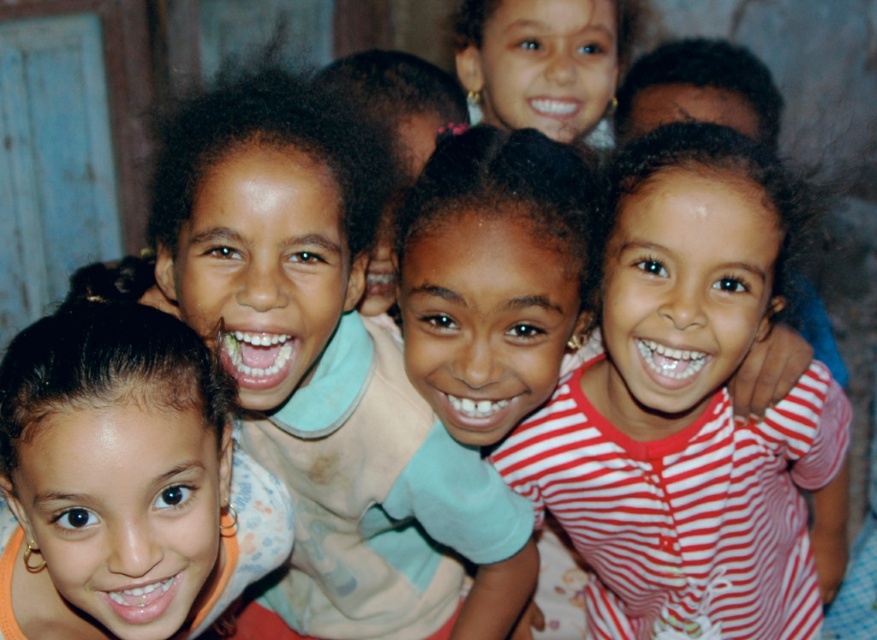
You are a photographer trying to capture a group shot of the children. You notice the matte orange shirt at lower left and the matte black hair at upper center. Which child should you adjust to the right to ensure both are centered in the frame?

You should move the matte orange shirt at lower left to the right since it is currently on the left side of the matte black hair at upper center, which would help center both in the frame.

You are a photographer trying to capture a closeup of the red striped shirt at center without including the matte black hair at upper center. Based on their sizes, is this possible?

The red striped shirt at center is bigger than matte black hair at upper center, so it might be possible to frame the shot to focus solely on the red striped shirt at center while excluding the matte black hair at upper center, depending on their spatial arrangement.